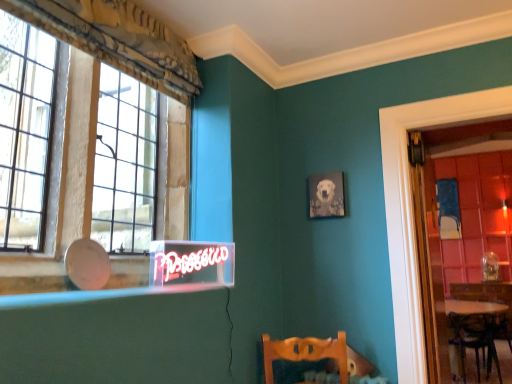
Question: Is glass paneled window at left oriented away from clear glass door at right?

Choices:
 (A) no
 (B) yes

Answer: (A)

Question: Is glass paneled window at left beside clear glass door at right?

Choices:
 (A) no
 (B) yes

Answer: (A)

Question: Can you confirm if glass paneled window at left is bigger than clear glass door at right?

Choices:
 (A) no
 (B) yes

Answer: (B)

Question: From a real-world perspective, is glass paneled window at left physically above clear glass door at right?

Choices:
 (A) no
 (B) yes

Answer: (B)

Question: Is glass paneled window at left not inside clear glass door at right?

Choices:
 (A) no
 (B) yes

Answer: (B)

Question: Is glass paneled window at left surrounding clear glass door at right?

Choices:
 (A) yes
 (B) no

Answer: (B)

Question: Considering the relative sizes of glass paneled window at left and matte glass window sill at lower left in the image provided, is glass paneled window at left shorter than matte glass window sill at lower left?

Choices:
 (A) no
 (B) yes

Answer: (A)

Question: Is glass paneled window at left oriented away from matte glass window sill at lower left?

Choices:
 (A) no
 (B) yes

Answer: (A)

Question: From the image's perspective, does glass paneled window at left appear higher than matte glass window sill at lower left?

Choices:
 (A) no
 (B) yes

Answer: (B)

Question: Is the depth of glass paneled window at left less than that of matte glass window sill at lower left?

Choices:
 (A) no
 (B) yes

Answer: (A)

Question: Would you consider glass paneled window at left to be distant from matte glass window sill at lower left?

Choices:
 (A) yes
 (B) no

Answer: (B)

Question: Is glass paneled window at left next to matte glass window sill at lower left and touching it?

Choices:
 (A) yes
 (B) no

Answer: (B)

Question: Is matte gray canvas at upper center positioned beyond the bounds of glass paneled window at left?

Choices:
 (A) no
 (B) yes

Answer: (B)